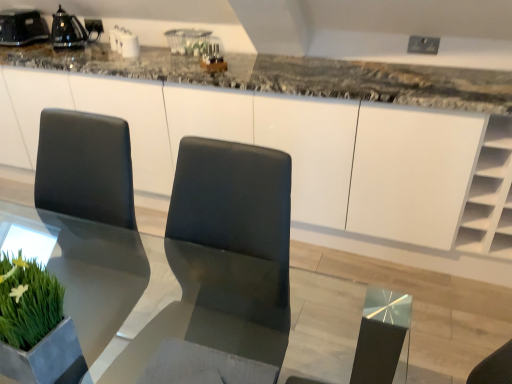
Find the location of `black glossy kettle at upper left, arranged as the 2th appliance when viewed from the left`. black glossy kettle at upper left, arranged as the 2th appliance when viewed from the left is located at coordinates (72, 30).

This screenshot has height=384, width=512. What are the coordinates of `black glossy kettle at upper left, arranged as the 2th appliance when viewed from the left` in the screenshot? It's located at pos(72,30).

Would you say black glossy kettle at upper left, the 2th appliance in the right-to-left sequence, is to the left or to the right of transparent glass table at center in the picture?

black glossy kettle at upper left, the 2th appliance in the right-to-left sequence, is positioned on transparent glass table at center's left side.

From a real-world perspective, is black glossy kettle at upper left, the 2th appliance in the right-to-left sequence, positioned under transparent glass table at center based on gravity?

No, from a real-world perspective, black glossy kettle at upper left, the 2th appliance in the right-to-left sequence, is not under transparent glass table at center.

Based on their sizes in the image, would you say black glossy kettle at upper left, the 2th appliance in the right-to-left sequence, is bigger or smaller than transparent glass table at center?

black glossy kettle at upper left, the 2th appliance in the right-to-left sequence, is smaller than transparent glass table at center.

Which is correct: black glossy kettle at upper left, the 2th appliance in the right-to-left sequence, is inside transparent glass table at center, or outside of it?

The correct answer is: outside.

Considering the relative sizes of black glossy kettle at upper left, arranged as the 2th appliance when viewed from the left, and black glossy kettle at upper left, the 2th appliance in the right-to-left sequence, in the image provided, is black glossy kettle at upper left, arranged as the 2th appliance when viewed from the left, wider than black glossy kettle at upper left, the 2th appliance in the right-to-left sequence,?

No, black glossy kettle at upper left, arranged as the 2th appliance when viewed from the left, is not wider than black glossy kettle at upper left, the 2th appliance in the right-to-left sequence.

Is black glossy kettle at upper left, arranged as the 2th appliance when viewed from the left, to the right of black glossy kettle at upper left, positioned as the 1th appliance in left-to-right order, from the viewer's perspective?

Indeed, black glossy kettle at upper left, arranged as the 2th appliance when viewed from the left, is positioned on the right side of black glossy kettle at upper left, positioned as the 1th appliance in left-to-right order.

Consider the image. Considering the relative positions of black glossy kettle at upper left, which is counted as the first appliance, starting from the right, and black glossy kettle at upper left, positioned as the 1th appliance in left-to-right order, in the image provided, is black glossy kettle at upper left, which is counted as the first appliance, starting from the right, in front of black glossy kettle at upper left, positioned as the 1th appliance in left-to-right order,?

Yes, black glossy kettle at upper left, which is counted as the first appliance, starting from the right, is closer to the camera.

What's the angular difference between black glossy kettle at upper left, which is counted as the first appliance, starting from the right, and black glossy kettle at upper left, positioned as the 1th appliance in left-to-right order,'s facing directions?

They differ by 0.565 degrees in their facing directions.

At what (x,y) coordinates should I click in order to perform the action: click on table below the green leafy plant at lower left (from the image's perspective). Please return your answer as a coordinate pair (x, y). The height and width of the screenshot is (384, 512). Looking at the image, I should click on (160, 301).

From the image's perspective, is green leafy plant at lower left over transparent glass table at center?

Yes.

Is green leafy plant at lower left closer to the viewer compared to transparent glass table at center?

No, green leafy plant at lower left is further to the viewer.

Considering the sizes of green leafy plant at lower left and transparent glass table at center in the image, is green leafy plant at lower left taller or shorter than transparent glass table at center?

In the image, green leafy plant at lower left appears to be shorter than transparent glass table at center.

Is transparent glass table at center not inside black glossy kettle at upper left, positioned as the 1th appliance in left-to-right order?

That's correct, transparent glass table at center is outside of black glossy kettle at upper left, positioned as the 1th appliance in left-to-right order.

Which is more to the right, transparent glass table at center or black glossy kettle at upper left, positioned as the 1th appliance in left-to-right order?

transparent glass table at center.

Measure the distance between transparent glass table at center and black glossy kettle at upper left, the 2th appliance in the right-to-left sequence.

The distance of transparent glass table at center from black glossy kettle at upper left, the 2th appliance in the right-to-left sequence, is 1.89 meters.

How many degrees apart are the facing directions of green leafy plant at lower left and black glossy kettle at upper left, arranged as the 2th appliance when viewed from the left?

4.44 degrees separate the facing orientations of green leafy plant at lower left and black glossy kettle at upper left, arranged as the 2th appliance when viewed from the left.

Is green leafy plant at lower left to the left of black glossy kettle at upper left, arranged as the 2th appliance when viewed from the left, from the viewer's perspective?

No.

Is black glossy kettle at upper left, arranged as the 2th appliance when viewed from the left, inside green leafy plant at lower left?

No, black glossy kettle at upper left, arranged as the 2th appliance when viewed from the left, is located outside of green leafy plant at lower left.

Considering the sizes of objects green leafy plant at lower left and black glossy kettle at upper left, which is counted as the first appliance, starting from the right, in the image provided, who is smaller, green leafy plant at lower left or black glossy kettle at upper left, which is counted as the first appliance, starting from the right,?

Smaller between the two is black glossy kettle at upper left, which is counted as the first appliance, starting from the right.

Can you confirm if transparent glass table at center is positioned to the right of black glossy kettle at upper left, which is counted as the first appliance, starting from the right?

Yes.

From a real-world perspective, is transparent glass table at center physically above black glossy kettle at upper left, arranged as the 2th appliance when viewed from the left?

No, from a real-world perspective, transparent glass table at center is not above black glossy kettle at upper left, arranged as the 2th appliance when viewed from the left.

Which is less distant, (x=8, y=230) or (x=100, y=20)?

The point (x=8, y=230) is in front.

Considering the sizes of objects transparent glass table at center and black glossy kettle at upper left, which is counted as the first appliance, starting from the right, in the image provided, who is bigger, transparent glass table at center or black glossy kettle at upper left, which is counted as the first appliance, starting from the right,?

Bigger between the two is transparent glass table at center.

Based on the photo, considering the sizes of green leafy plant at lower left and black glossy kettle at upper left, positioned as the 1th appliance in left-to-right order, in the image, is green leafy plant at lower left wider or thinner than black glossy kettle at upper left, positioned as the 1th appliance in left-to-right order,?

In the image, green leafy plant at lower left appears to be more narrow than black glossy kettle at upper left, positioned as the 1th appliance in left-to-right order.

Are green leafy plant at lower left and black glossy kettle at upper left, the 2th appliance in the right-to-left sequence, making contact?

green leafy plant at lower left and black glossy kettle at upper left, the 2th appliance in the right-to-left sequence, are clearly separated.

Could you tell me if green leafy plant at lower left is facing black glossy kettle at upper left, the 2th appliance in the right-to-left sequence?

No, green leafy plant at lower left is not turned towards black glossy kettle at upper left, the 2th appliance in the right-to-left sequence.

From a real-world perspective, is green leafy plant at lower left positioned above or below black glossy kettle at upper left, the 2th appliance in the right-to-left sequence?

green leafy plant at lower left is below black glossy kettle at upper left, the 2th appliance in the right-to-left sequence.

This screenshot has width=512, height=384. What are the coordinates of `appliance that is the 2nd object located above the transparent glass table at center (from the image's perspective)` in the screenshot? It's located at (22, 27).

This screenshot has width=512, height=384. In the image, there is a black glossy kettle at upper left, the 2th appliance in the right-to-left sequence. Identify the location of appliance below it (from the image's perspective). (72, 30).

Estimate the real-world distances between objects in this image. Which object is further from black glossy kettle at upper left, positioned as the 1th appliance in left-to-right order, black glossy kettle at upper left, arranged as the 2th appliance when viewed from the left, or transparent glass table at center?

The object further to black glossy kettle at upper left, positioned as the 1th appliance in left-to-right order, is transparent glass table at center.

Based on their spatial positions, is green leafy plant at lower left or black glossy kettle at upper left, which is counted as the first appliance, starting from the right, closer to black glossy kettle at upper left, the 2th appliance in the right-to-left sequence?

black glossy kettle at upper left, which is counted as the first appliance, starting from the right, lies closer to black glossy kettle at upper left, the 2th appliance in the right-to-left sequence, than the other object.

When comparing their distances from green leafy plant at lower left, does transparent glass table at center or black glossy kettle at upper left, arranged as the 2th appliance when viewed from the left, seem closer?

transparent glass table at center.

Looking at the image, which one is located closer to transparent glass table at center, black glossy kettle at upper left, arranged as the 2th appliance when viewed from the left, or green leafy plant at lower left?

green leafy plant at lower left.

Based on their spatial positions, is black glossy kettle at upper left, positioned as the 1th appliance in left-to-right order, or green leafy plant at lower left closer to black glossy kettle at upper left, which is counted as the first appliance, starting from the right?

black glossy kettle at upper left, positioned as the 1th appliance in left-to-right order, is closer to black glossy kettle at upper left, which is counted as the first appliance, starting from the right.

Based on their spatial positions, is black glossy kettle at upper left, positioned as the 1th appliance in left-to-right order, or black glossy kettle at upper left, arranged as the 2th appliance when viewed from the left, closer to green leafy plant at lower left?

The object closer to green leafy plant at lower left is black glossy kettle at upper left, arranged as the 2th appliance when viewed from the left.

Looking at the image, which one is located further to green leafy plant at lower left, black glossy kettle at upper left, arranged as the 2th appliance when viewed from the left, or black glossy kettle at upper left, positioned as the 1th appliance in left-to-right order?

Based on the image, black glossy kettle at upper left, positioned as the 1th appliance in left-to-right order, appears to be further to green leafy plant at lower left.

Looking at the image, which one is located further to transparent glass table at center, green leafy plant at lower left or black glossy kettle at upper left, arranged as the 2th appliance when viewed from the left?

The object further to transparent glass table at center is black glossy kettle at upper left, arranged as the 2th appliance when viewed from the left.

You are a GUI agent. You are given a task and a screenshot of the screen. Output one action in this format:
    pyautogui.click(x=<x>, y=<y>)
    Task: Click on the appliance positioned between transparent glass table at center and black glossy kettle at upper left, the 2th appliance in the right-to-left sequence, from near to far
    Image resolution: width=512 pixels, height=384 pixels.
    Given the screenshot: What is the action you would take?
    coord(72,30)

The height and width of the screenshot is (384, 512). In order to click on appliance positioned between green leafy plant at lower left and black glossy kettle at upper left, positioned as the 1th appliance in left-to-right order, from near to far in this screenshot , I will do pos(72,30).

At what (x,y) coordinates should I click in order to perform the action: click on houseplant located between transparent glass table at center and black glossy kettle at upper left, positioned as the 1th appliance in left-to-right order, in the depth direction. Please return your answer as a coordinate pair (x, y). Looking at the image, I should click on (36, 327).

This screenshot has width=512, height=384. In order to click on houseplant positioned between transparent glass table at center and black glossy kettle at upper left, which is counted as the first appliance, starting from the right, from near to far in this screenshot , I will do `click(36, 327)`.